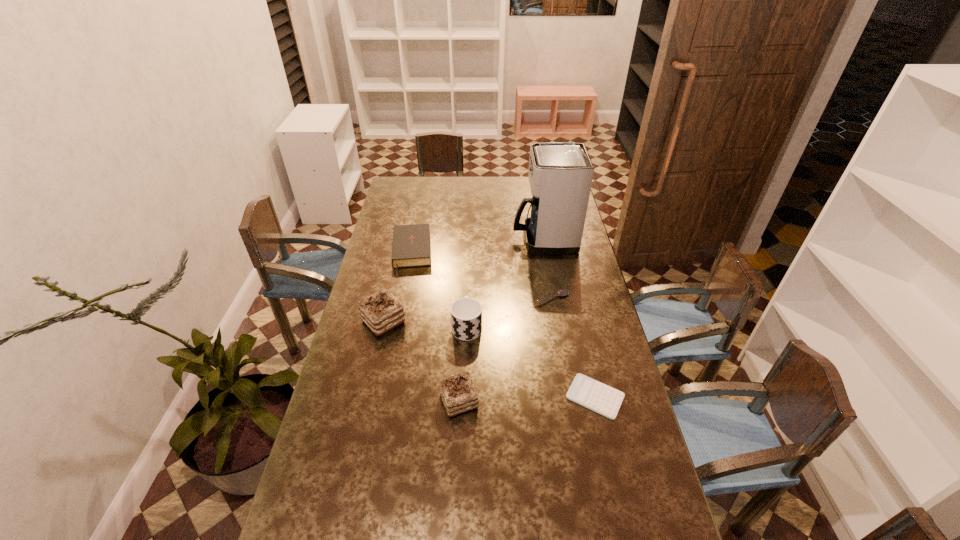
The height and width of the screenshot is (540, 960). In order to click on vacant space situated 0.360m on the back of the nearer chocolate cake in this screenshot , I will do 463,304.

Locate an element on the screen. vacant point located on the back of the Bible is located at coordinates (420, 206).

Where is `free spot located on the front panel of the tallest object`? free spot located on the front panel of the tallest object is located at coordinates (489, 238).

The width and height of the screenshot is (960, 540). Find the location of `vacant space located 0.070m on the front panel of the tallest object`. vacant space located 0.070m on the front panel of the tallest object is located at coordinates (497, 238).

Where is `vacant space located on the front panel of the tallest object`? The width and height of the screenshot is (960, 540). vacant space located on the front panel of the tallest object is located at coordinates (484, 238).

At what (x,y) coordinates should I click in order to perform the action: click on blank space located on the left of the calculator. Please return your answer as a coordinate pair (x, y). Looking at the image, I should click on (x=455, y=397).

This screenshot has height=540, width=960. Find the location of `free space located on the left of the third farthest object`. free space located on the left of the third farthest object is located at coordinates (516, 298).

You are a GUI agent. You are given a task and a screenshot of the screen. Output one action in this format:
    pyautogui.click(x=<x>, y=<y>)
    Task: Click on the vacant position located on the side of the cup with the handle
    The height and width of the screenshot is (540, 960).
    Given the screenshot: What is the action you would take?
    (x=469, y=253)

Image resolution: width=960 pixels, height=540 pixels. Identify the location of free space located 0.270m on the side of the cup with the handle. (468, 265).

At what (x,y) coordinates should I click in order to perform the action: click on vacant area situated 0.310m on the side of the cup with the handle. Please return your answer as a coordinate pair (x, y). The image size is (960, 540). Looking at the image, I should click on (468, 259).